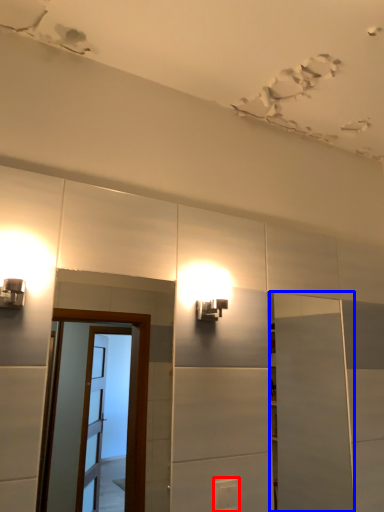
Question: Which object appears closest to the camera in this image, light switch (highlighted by a red box) or door (highlighted by a blue box)?

Choices:
 (A) light switch
 (B) door

Answer: (A)